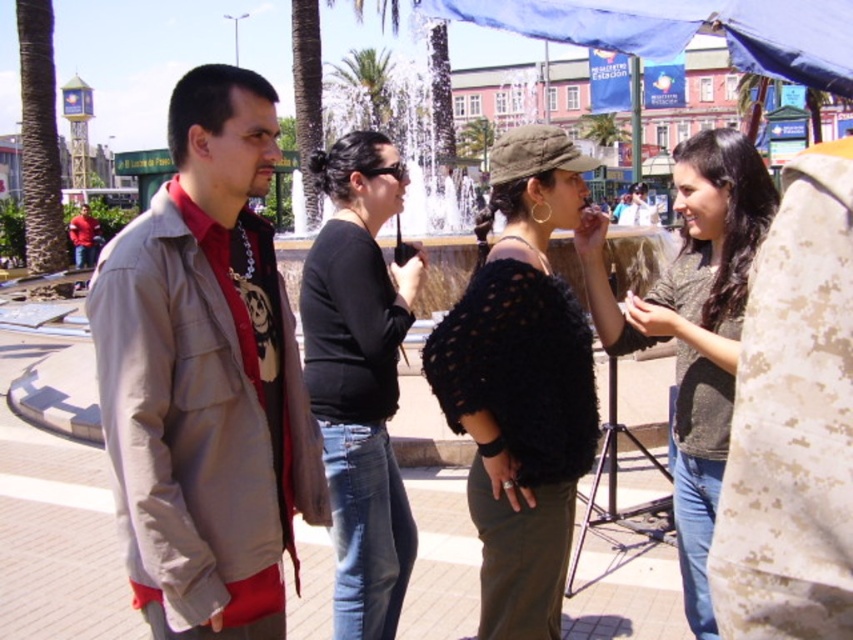
What is the object located at the coordinates point (521,384)?

The object located at point (521,384) is the black knitted sweater at center.

You are standing in the plaza and want to take a photo of the green leafy palm tree at upper center without the black matte sweater at center blocking the view. Is this possible?

Yes, because the black matte sweater at center is closer to the viewer than the green leafy palm tree at upper center, so you can position yourself to avoid the sweater blocking the palm tree.